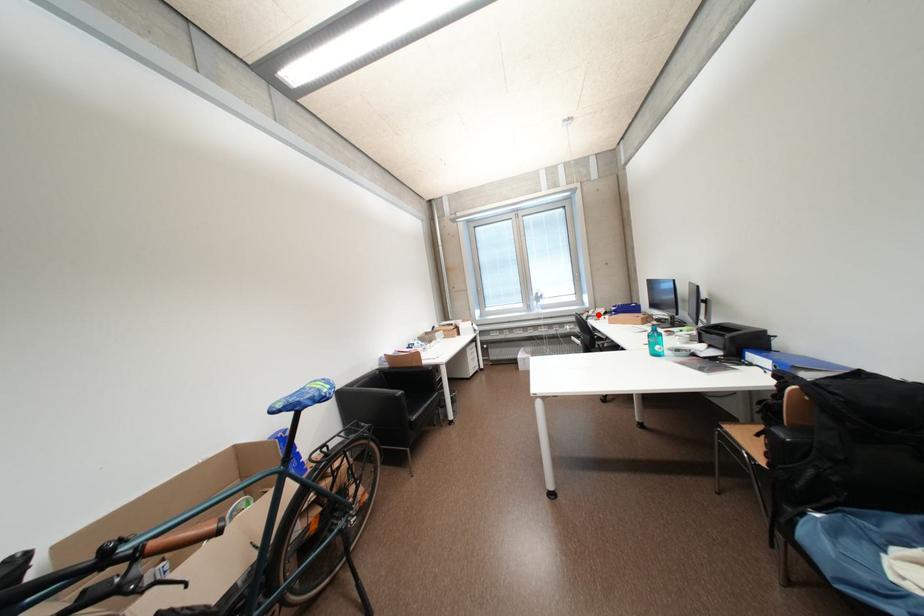
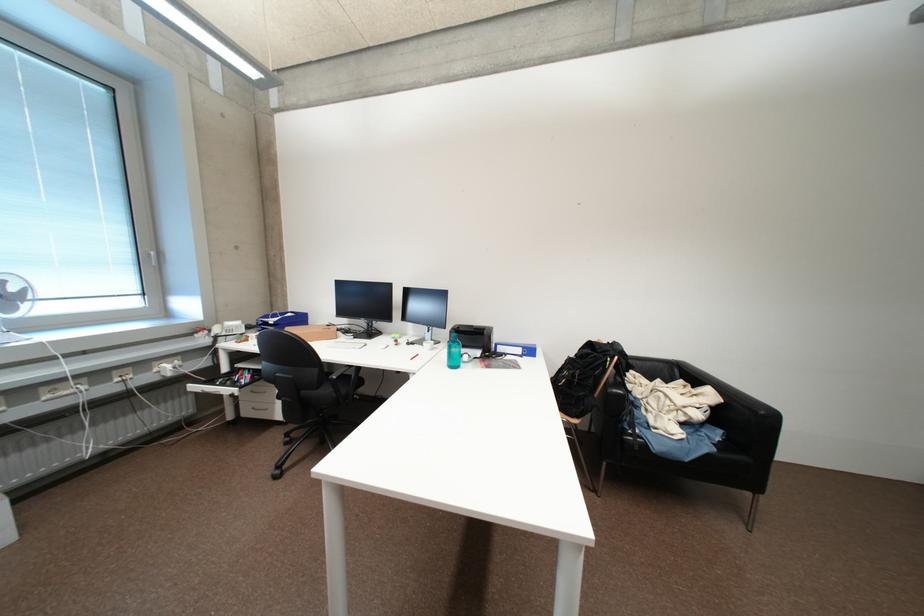
The point at the highlighted location is marked in the first image. Where is the corresponding point in the second image?

(225, 331)